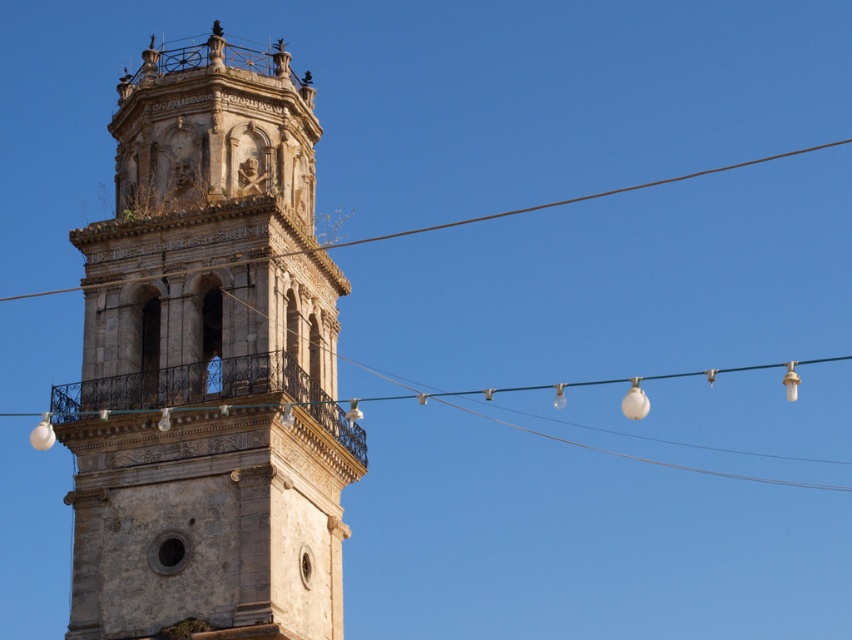
Question: Based on their relative distances, which object is nearer to the green wire at center?

Choices:
 (A) stone tower at left
 (B) brown wire at upper center

Answer: (A)

Question: Among these points, which one is farthest from the camera?

Choices:
 (A) (296, 157)
 (B) (792, 371)
 (C) (203, 268)

Answer: (B)

Question: Considering the relative positions of brown wire at upper center and green wire at center in the image provided, where is brown wire at upper center located with respect to green wire at center?

Choices:
 (A) left
 (B) right

Answer: (B)

Question: Among these objects, which one is nearest to the camera?

Choices:
 (A) green wire at center
 (B) stone tower at left

Answer: (B)

Question: Is stone tower at left wider than brown wire at upper center?

Choices:
 (A) no
 (B) yes

Answer: (A)

Question: Can you confirm if brown wire at upper center is wider than green wire at center?

Choices:
 (A) no
 (B) yes

Answer: (A)